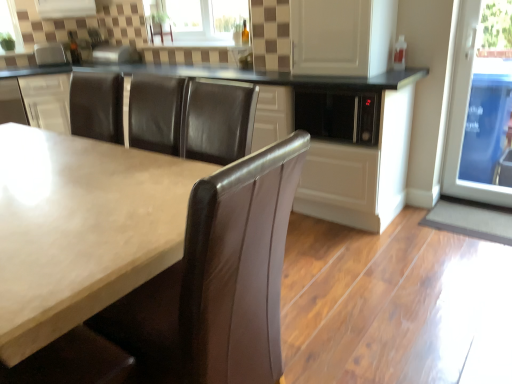
Where is `vacant location below transparent glass door at right (from a real-world perspective)`? vacant location below transparent glass door at right (from a real-world perspective) is located at coordinates (474, 202).